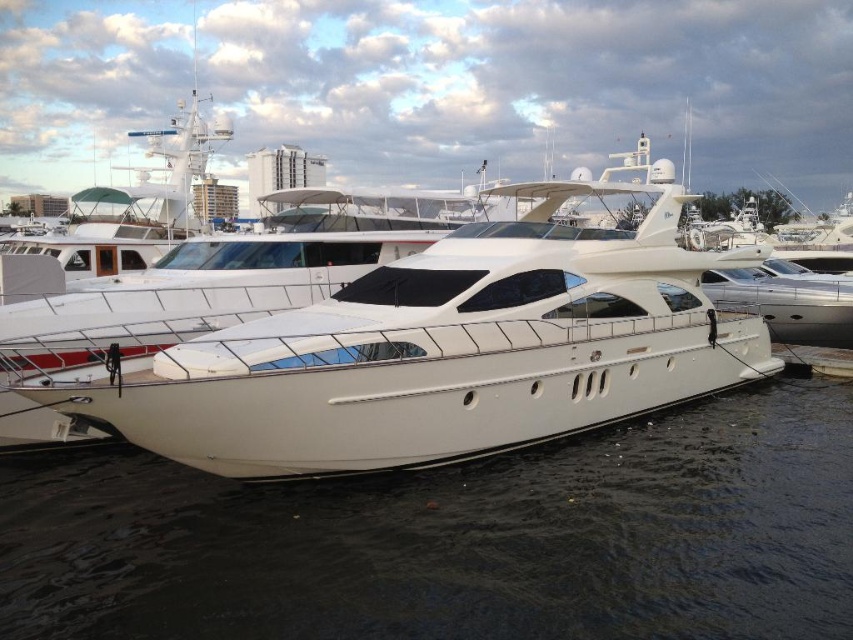
You are a photographer planning to capture the white glossy yacht at center and the white glossy water at lower center in a single frame. Based on their sizes, which one will appear larger in the photo?

The white glossy yacht at center will appear larger in the photo because it has a larger size than the white glossy water at lower center according to the description.

You are a photographer planning to take a photo of the white glossy yacht at center and the white glossy water at lower center. Based on their sizes in the image, which object would appear narrower in the photo?

The white glossy water at lower center is thinner than the white glossy yacht at center, so it would appear narrower in the photo.